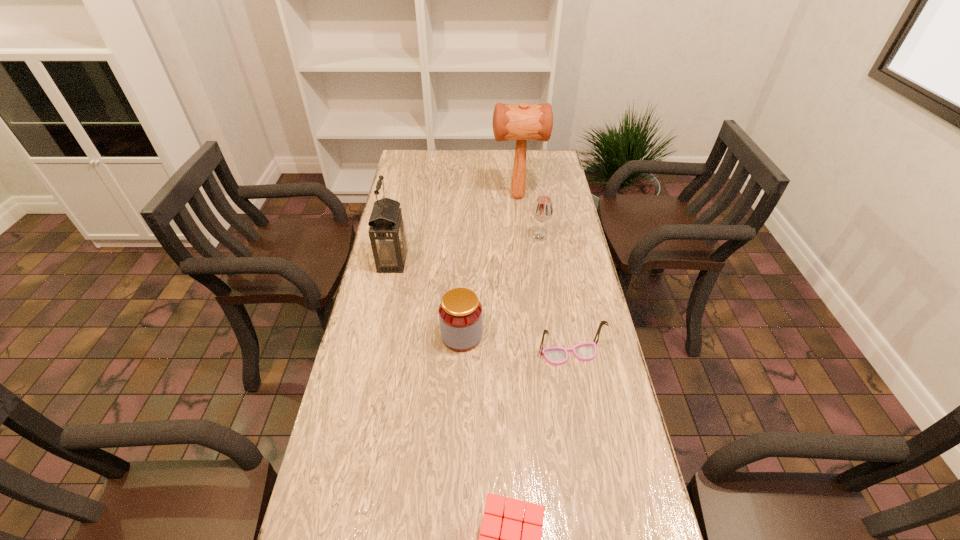
Locate an element on the screen. The height and width of the screenshot is (540, 960). the farthest object is located at coordinates (523, 122).

Locate an element on the screen. This screenshot has width=960, height=540. mallet is located at coordinates (523, 122).

Where is `the leftmost object`? the leftmost object is located at coordinates (387, 233).

What are the coordinates of `the fifth shortest object` in the screenshot? It's located at (387, 233).

Where is `the fifth nearest object`? Image resolution: width=960 pixels, height=540 pixels. the fifth nearest object is located at coordinates (542, 211).

The image size is (960, 540). Find the location of `jar`. jar is located at coordinates (460, 312).

Where is `spectacles`? The width and height of the screenshot is (960, 540). spectacles is located at coordinates (556, 356).

In order to click on vacant space located 0.180m on the strike surface of the tallest object in this screenshot , I will do `click(447, 197)`.

Locate an element on the screen. The width and height of the screenshot is (960, 540). free space located 0.250m on the strike surface of the tallest object is located at coordinates (430, 197).

Locate an element on the screen. The height and width of the screenshot is (540, 960). vacant region located 0.390m on the strike surface of the tallest object is located at coordinates (396, 197).